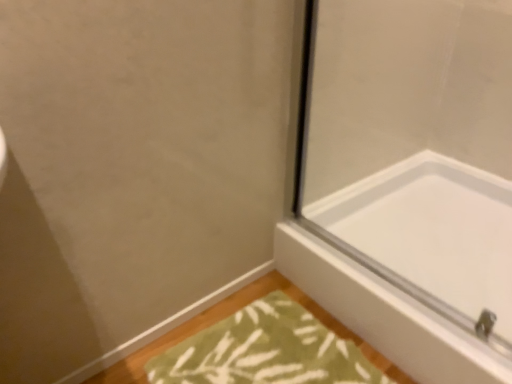
Question: Choose the correct answer: Is green textured bath mat at lower center inside white glossy bathtub at lower right or outside it?

Choices:
 (A) outside
 (B) inside

Answer: (A)

Question: From a real-world perspective, is green textured bath mat at lower center positioned above or below white glossy bathtub at lower right?

Choices:
 (A) below
 (B) above

Answer: (A)

Question: From the image's perspective, relative to white glossy bathtub at lower right, is green textured bath mat at lower center above or below?

Choices:
 (A) above
 (B) below

Answer: (B)

Question: In the image, is white glossy bathtub at lower right on the left side or the right side of green textured bath mat at lower center?

Choices:
 (A) right
 (B) left

Answer: (A)

Question: From the image's perspective, is white glossy bathtub at lower right above or below green textured bath mat at lower center?

Choices:
 (A) below
 (B) above

Answer: (B)

Question: Is white glossy bathtub at lower right in front of or behind green textured bath mat at lower center in the image?

Choices:
 (A) front
 (B) behind

Answer: (B)

Question: Considering the positions of point (296, 243) and point (318, 349), is point (296, 243) closer or farther from the camera than point (318, 349)?

Choices:
 (A) farther
 (B) closer

Answer: (A)